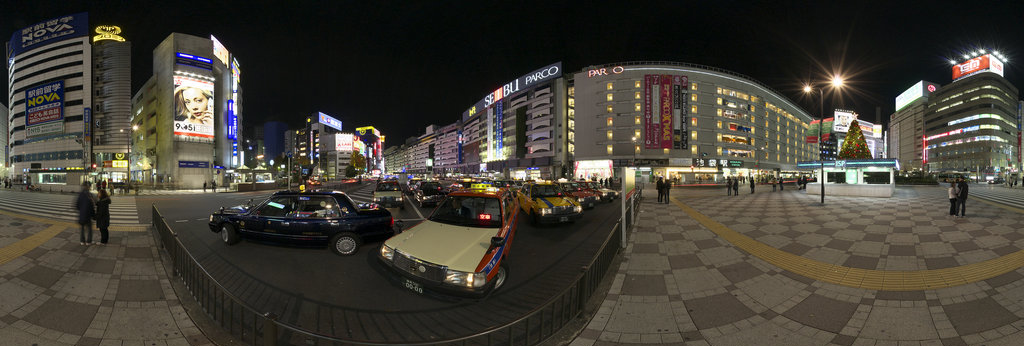
Identify the location of door. This screenshot has height=346, width=1024. (254, 243).